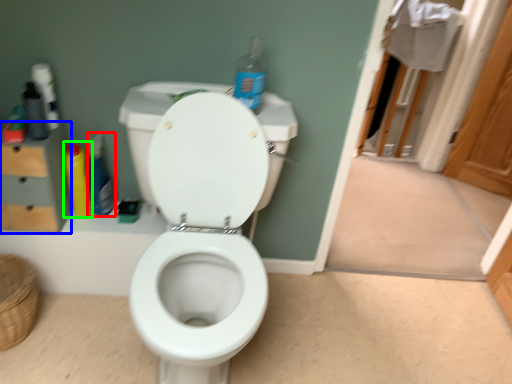
Question: Which object is the closest to the cleaning product (highlighted by a red box)? Choose among these: dresser (highlighted by a blue box) or cleaning product (highlighted by a green box).

Choices:
 (A) dresser
 (B) cleaning product

Answer: (B)